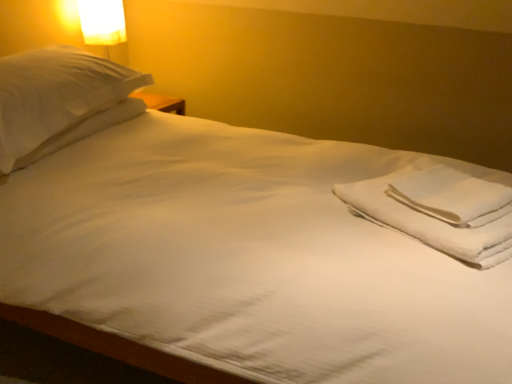
Identify the location of free space that is to the left of white soft towel at right. (379, 200).